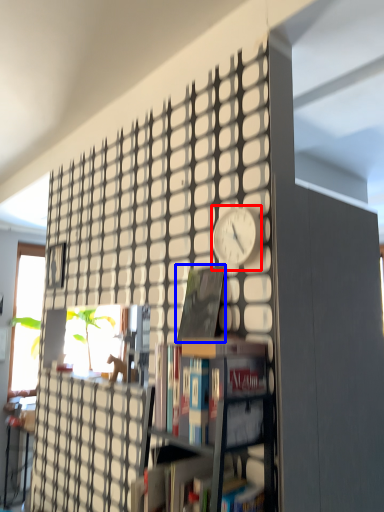
Question: Which object appears closest to the camera in this image, clock (highlighted by a red box) or book (highlighted by a blue box)?

Choices:
 (A) clock
 (B) book

Answer: (A)